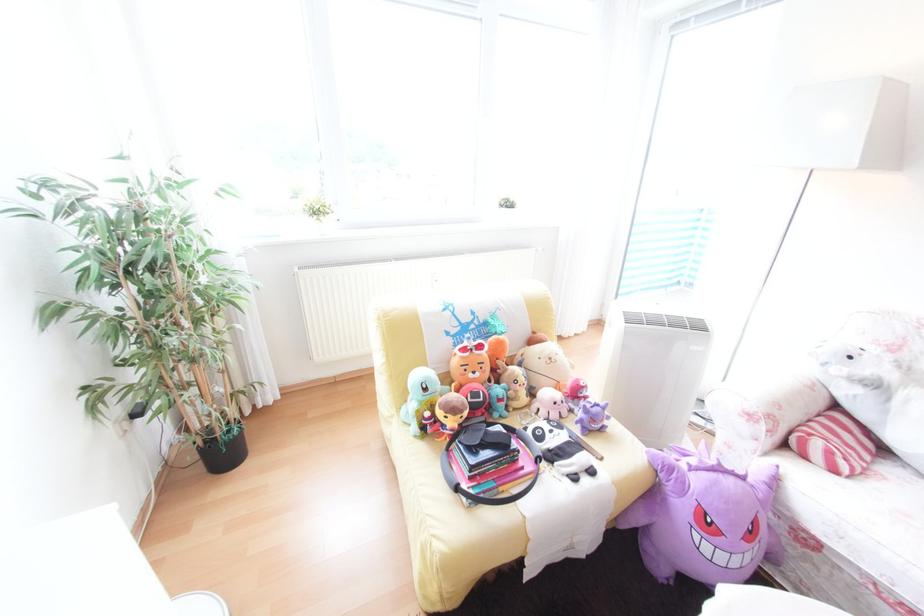
Find the location of `black plant pot`. black plant pot is located at coordinates (224, 448).